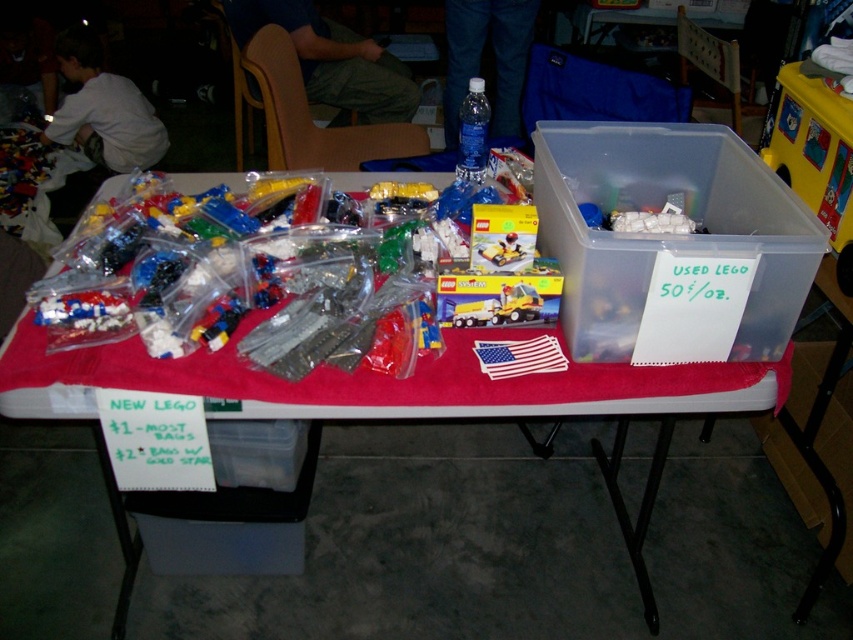
Question: Is red fabric table at center to the right of transparent plastic bottle at upper center from the viewer's perspective?

Choices:
 (A) yes
 (B) no

Answer: (B)

Question: Which is farther from the transparent plastic bottle at upper center?

Choices:
 (A) white matte shirt at upper left
 (B) yellow plastic toy at upper right
 (C) transparent plastic container at right
 (D) red fabric table at center

Answer: (A)

Question: Is red fabric table at center closer to the viewer compared to white matte shirt at upper left?

Choices:
 (A) yes
 (B) no

Answer: (A)

Question: Estimate the real-world distances between objects in this image. Which object is closer to the white matte shirt at upper left?

Choices:
 (A) transparent plastic bottle at upper center
 (B) red fabric table at center
 (C) transparent plastic container at right

Answer: (A)

Question: Is the position of transparent plastic container at right more distant than that of transparent plastic bottle at upper center?

Choices:
 (A) yes
 (B) no

Answer: (B)

Question: Estimate the real-world distances between objects in this image. Which object is closer to the transparent plastic bottle at upper center?

Choices:
 (A) yellow plastic toy at upper right
 (B) transparent plastic container at right
 (C) red fabric table at center

Answer: (B)